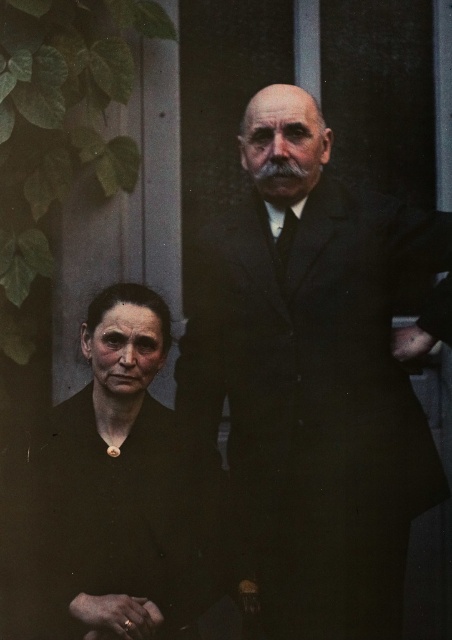
You are a photographer adjusting the lighting for a portrait. The dark brown suit at center and the dark brown fabric at lower left are both in the frame. Given that the distance between them is 9.33 inches, will a spotlight with a 10 inch diameter beam be able to illuminate both objects simultaneously?

The distance between the dark brown suit at center and the dark brown fabric at lower left is 9.33 inches. Since the spotlight has a 10 inch diameter beam, which is larger than the distance between them, the beam can cover both objects simultaneously.

Where is the dark brown suit at center located in the image?

The dark brown suit at center is located at point 0.591 on the x axis and 0.695 on the y axis.